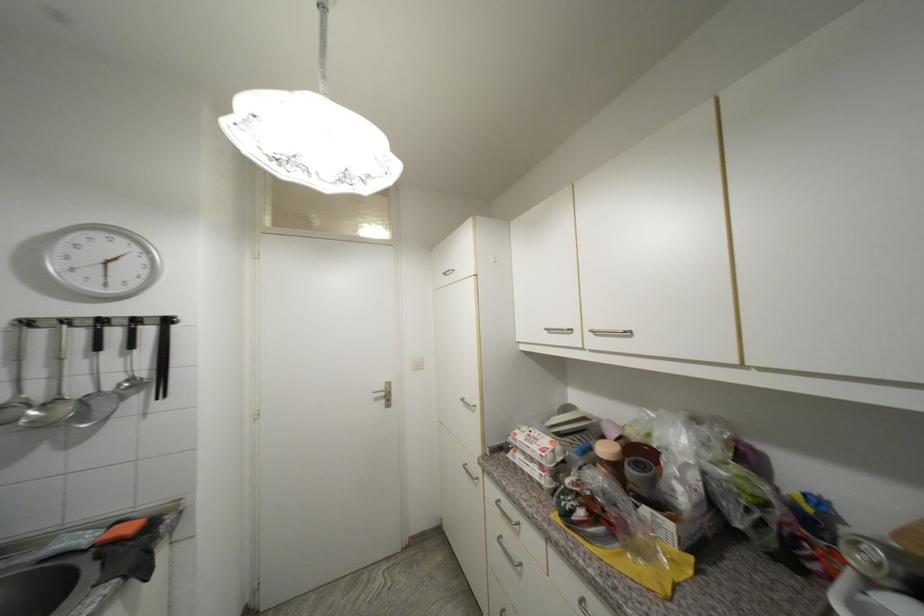
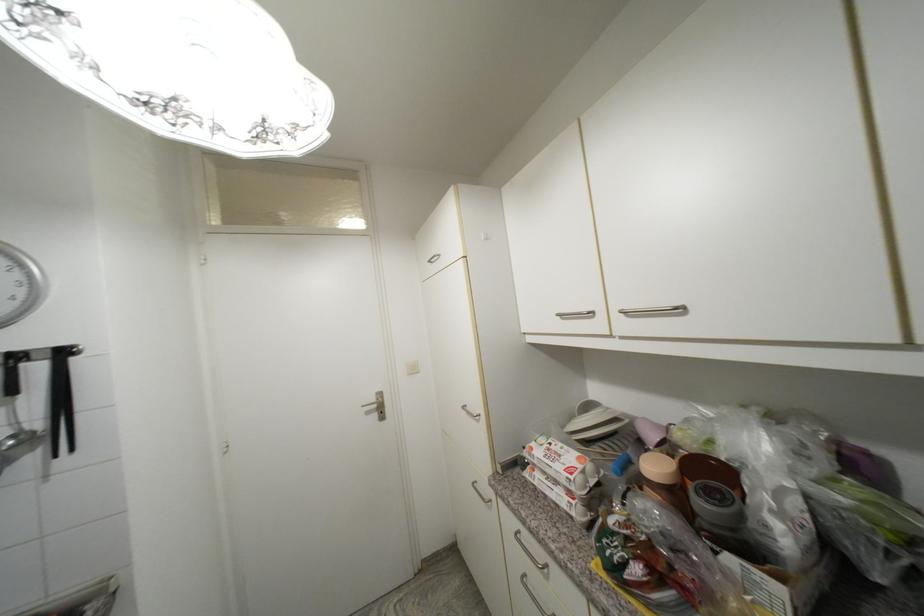
The point at [388,390] is marked in the first image. Where is the corresponding point in the second image?

(380, 400)